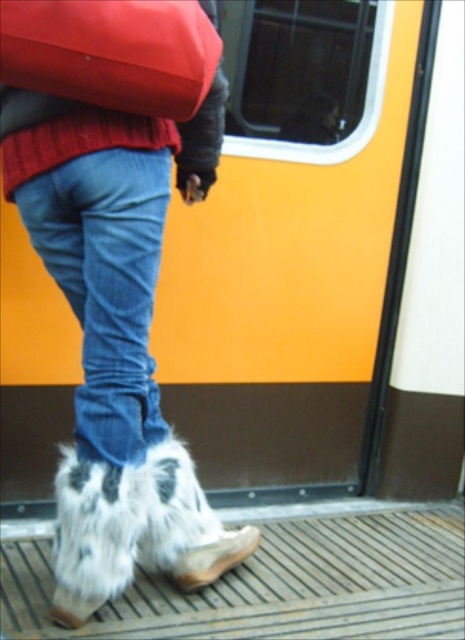
You are a delivery robot with a 36 inch wide package. You need to navigate between the matte red backpack at upper left and the brown suede boot at lower center to reach the delivery point. Can you fit through the space between them?

The distance between the matte red backpack at upper left and the brown suede boot at lower center is 35.91 inches. Since your package is 36 inches wide, it is slightly wider than the available space. You cannot fit through the space between them.

You are a photographer trying to capture the person boarding the train. You notice a matte red backpack at upper left located at point (x=112, y=52). To ensure the backpack is in the frame, where should you position your camera relative to the person?

The matte red backpack at upper left is located at point (x=112, y=52), so you should position your camera to the upper left of the person to include the backpack in the frame.